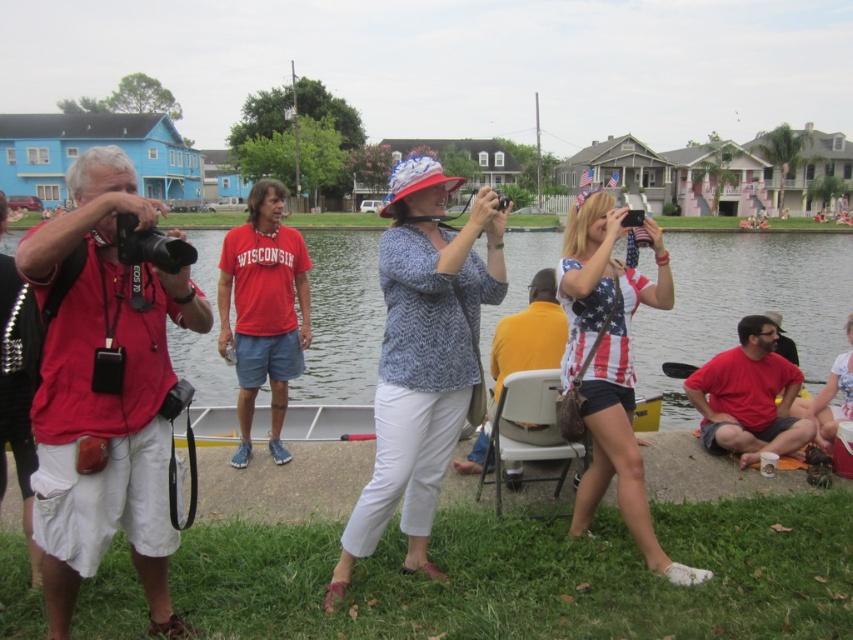
Question: Which point is farther to the camera?

Choices:
 (A) (399, 268)
 (B) (250, 406)
 (C) (143, 449)
 (D) (653, 272)

Answer: (D)

Question: Does matte red shirt at left have a smaller size compared to red cotton shirt at lower right?

Choices:
 (A) yes
 (B) no

Answer: (B)

Question: Is red cotton shirt at center positioned before white cotton shirt at center?

Choices:
 (A) yes
 (B) no

Answer: (B)

Question: Which point appears farthest from the camera in this image?

Choices:
 (A) (670, 292)
 (B) (270, 227)
 (C) (503, 358)
 (D) (796, 388)

Answer: (B)

Question: Does red cotton shirt at lower right lie in front of yellow matte shirt at center?

Choices:
 (A) yes
 (B) no

Answer: (B)

Question: Which point is farther to the camera?

Choices:
 (A) american flag fabric tank top at center
 (B) clear water at center
 (C) red cotton shirt at lower right

Answer: (C)